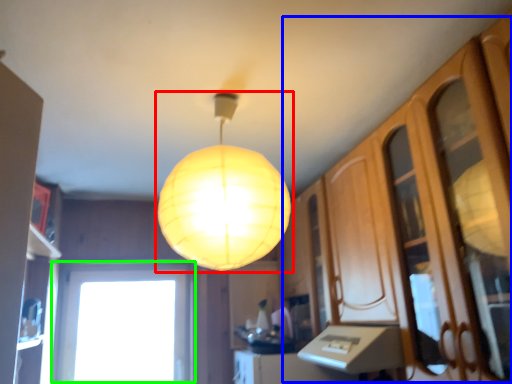
Question: Which object is positioned closest to lamp (highlighted by a red box)? Select from dresser (highlighted by a blue box) and window (highlighted by a green box).

Choices:
 (A) dresser
 (B) window

Answer: (A)